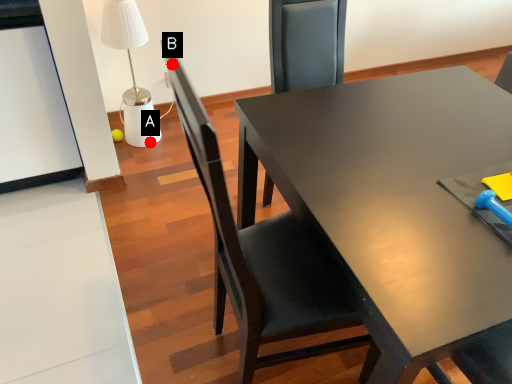
Question: Two points are circled on the image, labeled by A and B beside each circle. Which point is farther to the camera?

Choices:
 (A) A is further
 (B) B is further

Answer: (A)